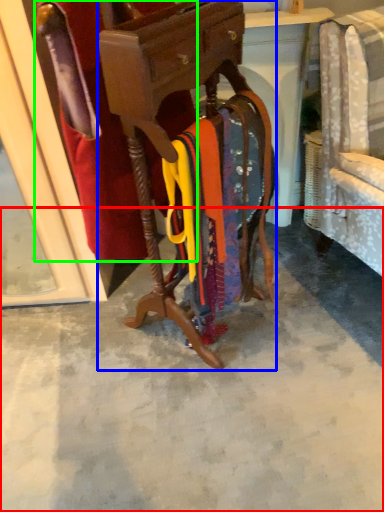
Question: Estimate the real-world distances between objects in this image. Which object is farther from concrete (highlighted by a red box), furniture (highlighted by a blue box) or robe (highlighted by a green box)?

Choices:
 (A) furniture
 (B) robe

Answer: (B)